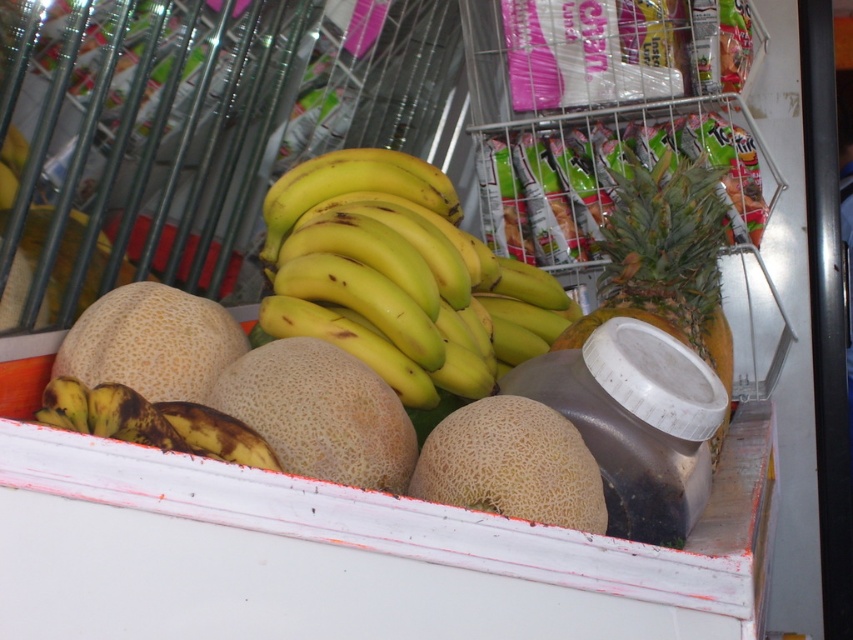
Based on the photo, you are a customer looking to grab both the yellow matte bananas at center and the light brown textured cantaloupe at center from the refrigerated display case. Which fruit should you reach for first to get the one closer to you?

You should reach for the yellow matte bananas at center first because it is closer to you than the light brown textured cantaloupe at center.

You are a grocery store employee who needs to stack items in a narrow shelf. You have the speckled brown cantaloupe at center and the brown spotted banana at lower left. Which item should you place first to fit both vertically?

The speckled brown cantaloupe at center is taller than the brown spotted banana at lower left, so you should place the speckled brown cantaloupe at center first to ensure both fit vertically on the shelf.

You are standing at the point labeled as point (x=334, y=288). You need to reach a shelf that is 4.34 feet away from you. If you take three steps forward, each covering 1.5 feet, will you reach the shelf?

Yes, because three steps of 1.5 feet each would cover 4.5 feet, which is more than the 4.34 feet distance to the shelf.